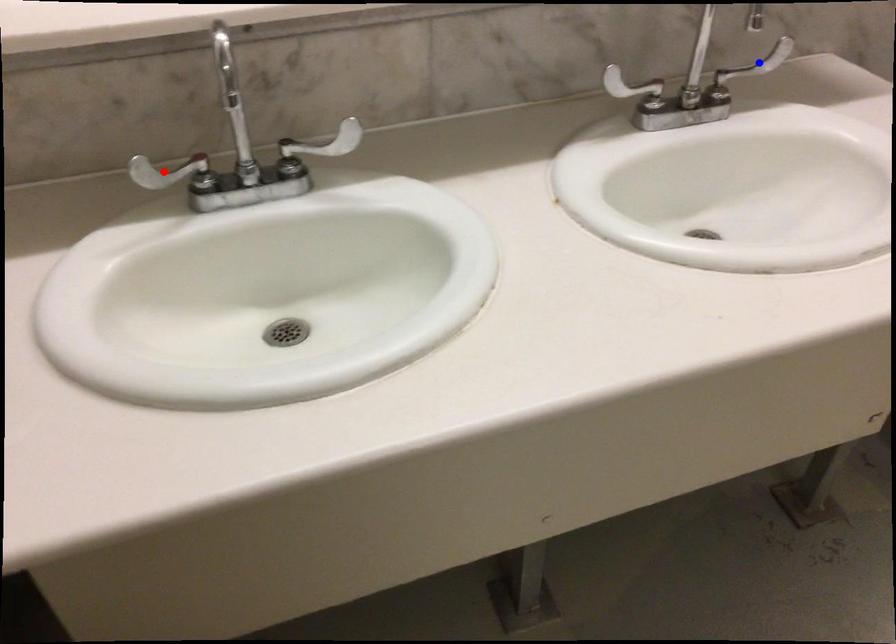
Question: Two points are marked on the image. Which point is closer to the camera?

Choices:
 (A) Blue point is closer.
 (B) Red point is closer.

Answer: (B)